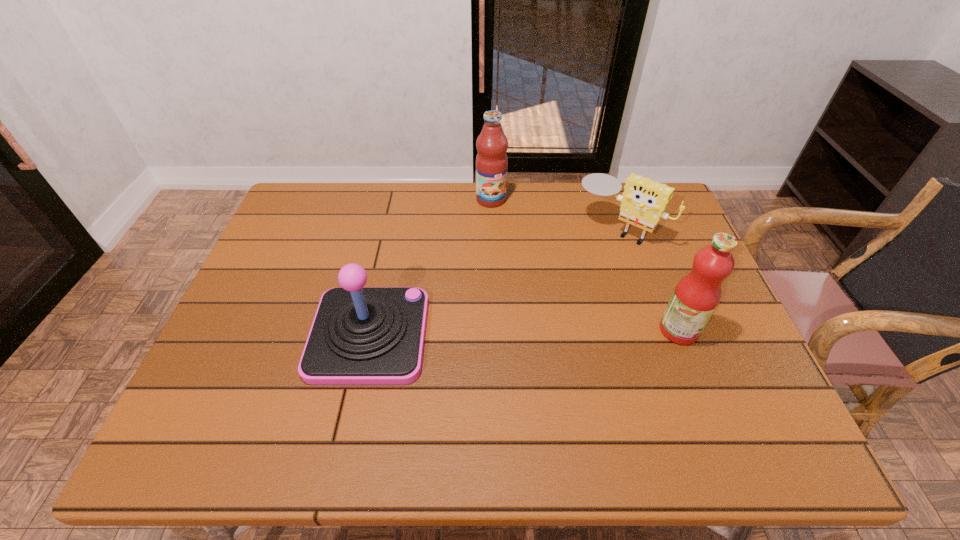
Where is `blank space located on the front-facing side of the sponge`? blank space located on the front-facing side of the sponge is located at coordinates (582, 266).

Where is `free space located on the front label of the left fruit juice`? Image resolution: width=960 pixels, height=540 pixels. free space located on the front label of the left fruit juice is located at coordinates (518, 248).

Locate an element on the screen. free spot located on the front label of the left fruit juice is located at coordinates (534, 276).

Where is `vacant space located on the front label of the left fruit juice`? The height and width of the screenshot is (540, 960). vacant space located on the front label of the left fruit juice is located at coordinates (528, 267).

Identify the location of sponge situated at the far edge. This screenshot has height=540, width=960. (643, 202).

Where is `fruit juice present at the far edge`? This screenshot has width=960, height=540. fruit juice present at the far edge is located at coordinates (491, 161).

The height and width of the screenshot is (540, 960). I want to click on object that is at the near edge, so click(x=360, y=335).

Where is `fruit juice at the right edge`? fruit juice at the right edge is located at coordinates (696, 296).

You are a GUI agent. You are given a task and a screenshot of the screen. Output one action in this format:
    pyautogui.click(x=<x>, y=<y>)
    Task: Click on the sponge positioned at the right edge
    
    Given the screenshot: What is the action you would take?
    point(643,202)

The image size is (960, 540). In order to click on object present at the far right corner in this screenshot , I will do `click(643, 202)`.